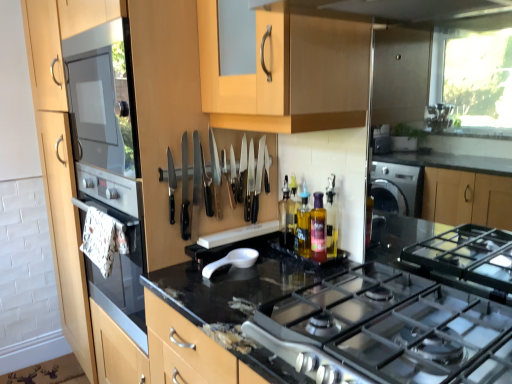
You are a GUI agent. You are given a task and a screenshot of the screen. Output one action in this format:
    pyautogui.click(x=<x>, y=<y>)
    Task: Click on the vacant area that is in front of translucent plastic bottle at center, the 3th bottle from the back
    
    Given the screenshot: What is the action you would take?
    pyautogui.click(x=311, y=280)